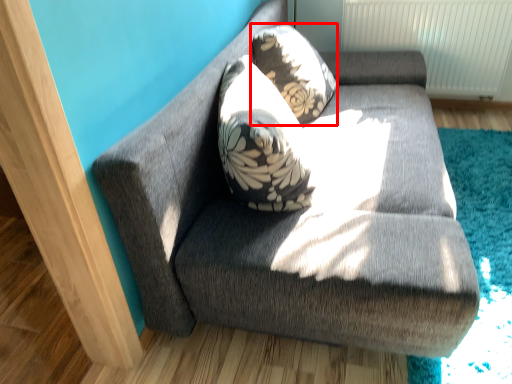
Question: From the image's perspective, what is the correct spatial relationship of throw pillow (annotated by the red box) in relation to studio couch?

Choices:
 (A) above
 (B) below

Answer: (A)